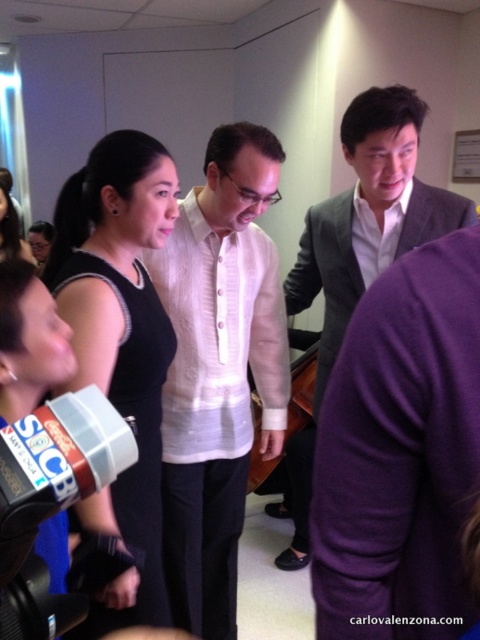
Looking at this image, you are standing at the entrance of the room and want to approach the person wearing the white linen shirt at center. Based on their position in the image, which direction should you move to reach them?

The white linen shirt at center is located at point (218, 369), so you should move towards the center of the room to reach them.

You are a photographer at an event and need to capture a clear shot of the white linen shirt at center without the black plastic video camera at lower left blocking the view. Is this possible based on their positions?

The white linen shirt at center is further to the viewer than the black plastic video camera at lower left, so yes, the photographer can capture a clear shot of the white linen shirt at center without obstruction from the camera.

You are standing in the room and want to locate the white linen shirt at center. According to the coordinates given, where would you find it?

The white linen shirt at center is located at coordinates point (218, 369).